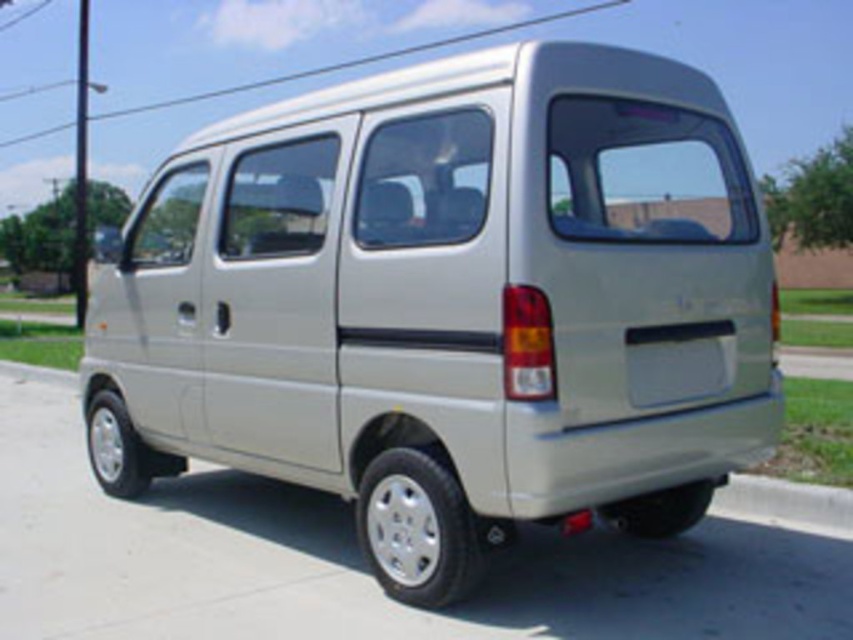
You are standing on the sidewalk and see the satin beige van at center and the gray concrete curb at lower right. Which object is nearer to you?

The satin beige van at center is closer to the viewer than the gray concrete curb at lower right, so the satin beige van at center is nearer to you.

You are driving a car that is 1.5 meters long. You need to park your car between the satin beige van at center and the gray concrete curb at lower right. Is there enough space for your car to fit between them?

The satin beige van at center is 1.51 meters away from the gray concrete curb at lower right. Since your car is 1.5 meters long, there is just enough space for your car to fit between them.